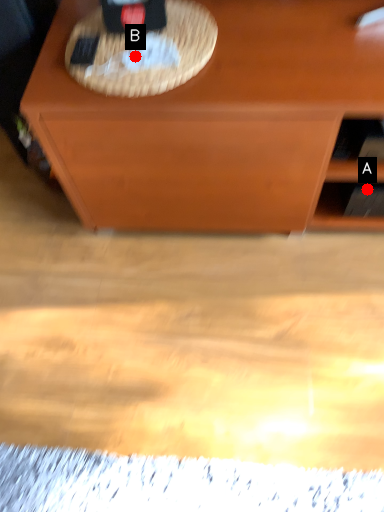
Question: Two points are circled on the image, labeled by A and B beside each circle. Among these points, which one is farthest from the camera?

Choices:
 (A) A is further
 (B) B is further

Answer: (A)